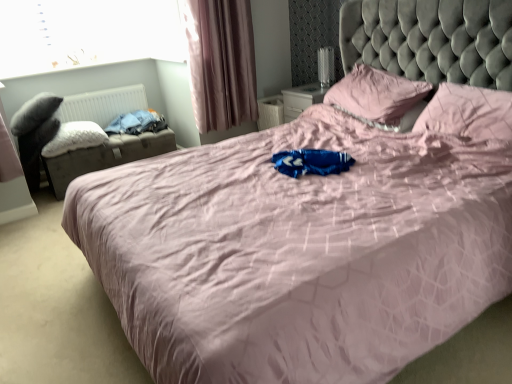
Question: From a real-world perspective, is white plastic radiator at left located beneath leatherette storage ottoman at left?

Choices:
 (A) yes
 (B) no

Answer: (B)

Question: Does white plastic radiator at left have a smaller size compared to leatherette storage ottoman at left?

Choices:
 (A) yes
 (B) no

Answer: (A)

Question: Is leatherette storage ottoman at left located within white plastic radiator at left?

Choices:
 (A) yes
 (B) no

Answer: (B)

Question: Does white plastic radiator at left appear on the right side of leatherette storage ottoman at left?

Choices:
 (A) no
 (B) yes

Answer: (A)

Question: Is white plastic radiator at left touching leatherette storage ottoman at left?

Choices:
 (A) no
 (B) yes

Answer: (A)

Question: Considering the relative sizes of white plastic radiator at left and leatherette storage ottoman at left in the image provided, is white plastic radiator at left taller than leatherette storage ottoman at left?

Choices:
 (A) yes
 (B) no

Answer: (B)

Question: Are transparent glass window at upper left and white plastic radiator at left making contact?

Choices:
 (A) yes
 (B) no

Answer: (B)

Question: Can you confirm if transparent glass window at upper left is positioned to the right of white plastic radiator at left?

Choices:
 (A) no
 (B) yes

Answer: (A)

Question: Can you confirm if transparent glass window at upper left is bigger than white plastic radiator at left?

Choices:
 (A) yes
 (B) no

Answer: (A)

Question: Is there a large distance between transparent glass window at upper left and white plastic radiator at left?

Choices:
 (A) no
 (B) yes

Answer: (A)

Question: From the image's perspective, would you say transparent glass window at upper left is positioned over white plastic radiator at left?

Choices:
 (A) yes
 (B) no

Answer: (A)

Question: Considering the relative positions of transparent glass window at upper left and white plastic radiator at left in the image provided, is transparent glass window at upper left to the left of white plastic radiator at left from the viewer's perspective?

Choices:
 (A) yes
 (B) no

Answer: (A)

Question: Is transparent glass window at upper left to the left of pink fabric pillow at upper right, the 3th pillow when ordered from left to right, from the viewer's perspective?

Choices:
 (A) yes
 (B) no

Answer: (A)